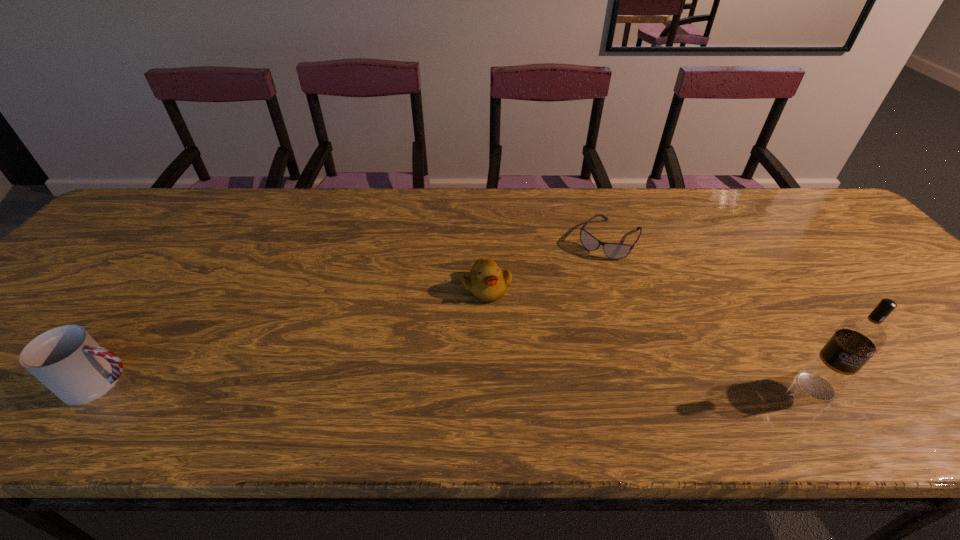
Where is `the leftmost object`? This screenshot has width=960, height=540. the leftmost object is located at coordinates (67, 360).

Where is `the second tallest object`? The image size is (960, 540). the second tallest object is located at coordinates (67, 360).

Identify the location of the tallest object. (857, 339).

The height and width of the screenshot is (540, 960). I want to click on vodka, so click(857, 339).

I want to click on the third tallest object, so click(487, 282).

The width and height of the screenshot is (960, 540). In order to click on the third nearest object in this screenshot , I will do `click(487, 282)`.

At what (x,y) coordinates should I click in order to perform the action: click on the shortest object. Please return your answer as a coordinate pair (x, y). Looking at the image, I should click on pos(615,251).

Locate an element on the screen. The height and width of the screenshot is (540, 960). sunglasses is located at coordinates (615, 251).

I want to click on vacant space located 0.220m on the side of the cup where the handle is located, so click(x=247, y=383).

Where is `free region located on the front-facing side of the duckling`? free region located on the front-facing side of the duckling is located at coordinates (539, 375).